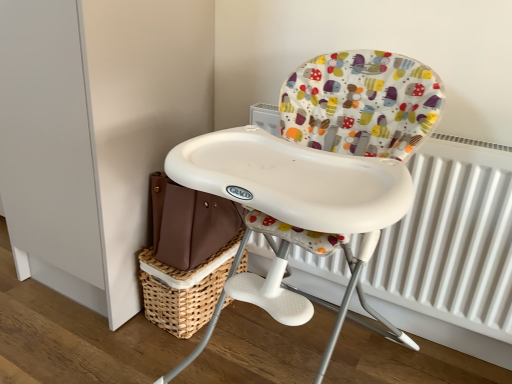
You are a GUI agent. You are given a task and a screenshot of the screen. Output one action in this format:
    pyautogui.click(x=<x>, y=<y>)
    Task: Click on the woven brown basket at lower center
    The height and width of the screenshot is (384, 512).
    Given the screenshot: What is the action you would take?
    [x=184, y=290]

At what (x,y) coordinates should I click in order to perform the action: click on white plastic highchair at center. Please return your answer as a coordinate pair (x, y). Looking at the image, I should click on (317, 172).

Consider the image. How different are the orientations of woven brown basket at lower center and white plastic highchair at center in degrees?

There is a 0.000281-degree angle between the facing directions of woven brown basket at lower center and white plastic highchair at center.

Is white plastic highchair at center at the back of woven brown basket at lower center?

No, woven brown basket at lower center is not facing away from white plastic highchair at center.

Considering the relative sizes of woven brown basket at lower center and white plastic highchair at center in the image provided, is woven brown basket at lower center wider than white plastic highchair at center?

Incorrect, the width of woven brown basket at lower center does not surpass that of white plastic highchair at center.

Which object is thinner, woven brown basket at lower center or white metallic radiator at right?

white metallic radiator at right.

From a real-world perspective, which is physically above, woven brown basket at lower center or white metallic radiator at right?

white metallic radiator at right is physically above.

Is woven brown basket at lower center not inside white metallic radiator at right?

Yes, woven brown basket at lower center is located beyond the bounds of white metallic radiator at right.

From a real-world perspective, is white plastic highchair at center physically above white metallic radiator at right?

Yes, from a real-world perspective, white plastic highchair at center is over white metallic radiator at right

Considering the relative positions of white plastic highchair at center and white metallic radiator at right in the image provided, is white plastic highchair at center to the left or to the right of white metallic radiator at right?

Based on their positions, white plastic highchair at center is located to the left of white metallic radiator at right.

Is white plastic highchair at center looking in the opposite direction of white metallic radiator at right?

Yes, white plastic highchair at center is facing away from white metallic radiator at right.

Does point (179, 183) lie behind point (208, 290)?

No.

Is the depth of white plastic highchair at center less than that of woven brown basket at lower center?

Yes.

Consider the image. From the image's perspective, is white plastic highchair at center above woven brown basket at lower center?

Yes, from the image's perspective, white plastic highchair at center is over woven brown basket at lower center.

Locate an element on the screen. Image resolution: width=512 pixels, height=384 pixels. basket that appears behind the white plastic highchair at center is located at coordinates (184, 290).

Which is closer to the camera, (409, 286) or (147, 291)?

Point (409, 286) appears to be closer to the viewer than point (147, 291).

Is the depth of white metallic radiator at right greater than that of woven brown basket at lower center?

No, white metallic radiator at right is closer to the viewer.

From the image's perspective, relative to woven brown basket at lower center, is white metallic radiator at right above or below?

white metallic radiator at right is situated higher than woven brown basket at lower center in the image.

Based on the photo, how far apart are white metallic radiator at right and woven brown basket at lower center?

white metallic radiator at right and woven brown basket at lower center are 23.67 inches apart from each other.

Is white metallic radiator at right touching white plastic highchair at center?

No, white metallic radiator at right is not touching white plastic highchair at center.

Which of these two, white metallic radiator at right or white plastic highchair at center, is wider?

white plastic highchair at center is wider.

Locate an element on the screen. This screenshot has width=512, height=384. basket behind the white plastic highchair at center is located at coordinates 184,290.

The width and height of the screenshot is (512, 384). In order to click on radiator on the right of woven brown basket at lower center in this screenshot , I will do `click(452, 239)`.

Considering their positions, is woven brown basket at lower center positioned further to white plastic highchair at center than white metallic radiator at right?

Among the two, woven brown basket at lower center is located further to white plastic highchair at center.

Based on their spatial positions, is white metallic radiator at right or white plastic highchair at center further from woven brown basket at lower center?

The object further to woven brown basket at lower center is white metallic radiator at right.

From the image, which object appears to be nearer to white metallic radiator at right, woven brown basket at lower center or white plastic highchair at center?

Among the two, white plastic highchair at center is located nearer to white metallic radiator at right.

Estimate the real-world distances between objects in this image. Which object is closer to woven brown basket at lower center, white plastic highchair at center or white metallic radiator at right?

white plastic highchair at center is positioned closer to the anchor woven brown basket at lower center.

When comparing their distances from white plastic highchair at center, does white metallic radiator at right or woven brown basket at lower center seem closer?

Based on the image, white metallic radiator at right appears to be nearer to white plastic highchair at center.

Estimate the real-world distances between objects in this image. Which object is closer to white metallic radiator at right, white plastic highchair at center or woven brown basket at lower center?

Based on the image, white plastic highchair at center appears to be nearer to white metallic radiator at right.

Where is `chair between woven brown basket at lower center and white metallic radiator at right from left to right`? This screenshot has height=384, width=512. chair between woven brown basket at lower center and white metallic radiator at right from left to right is located at coordinates (317, 172).